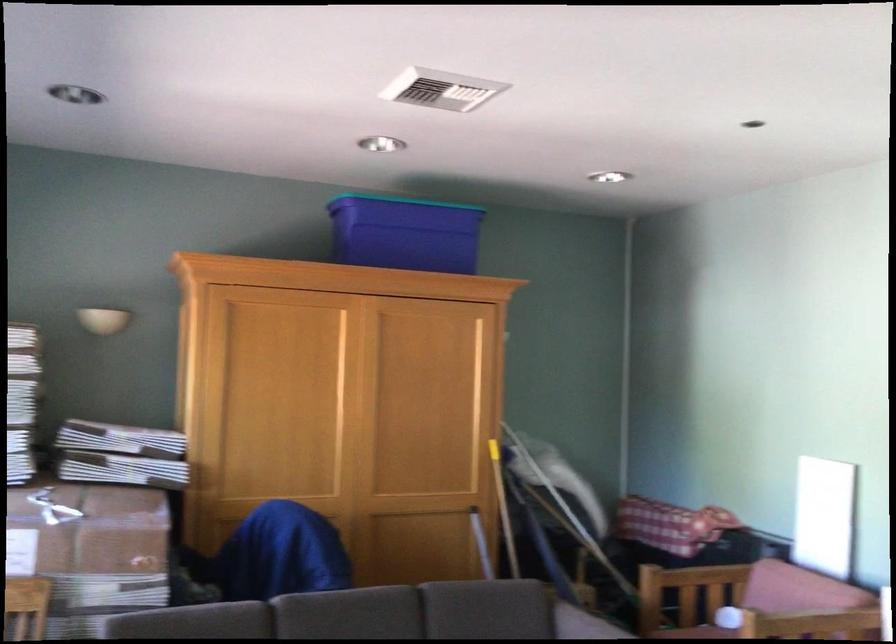
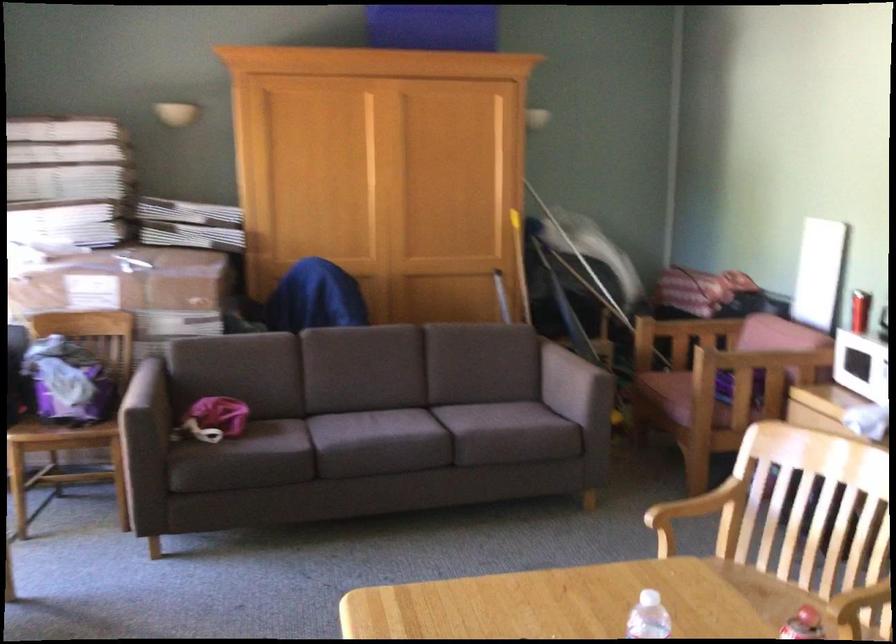
In a continuous first-person perspective shot, in which direction is the camera moving?

The cameraman walked toward right, backward.